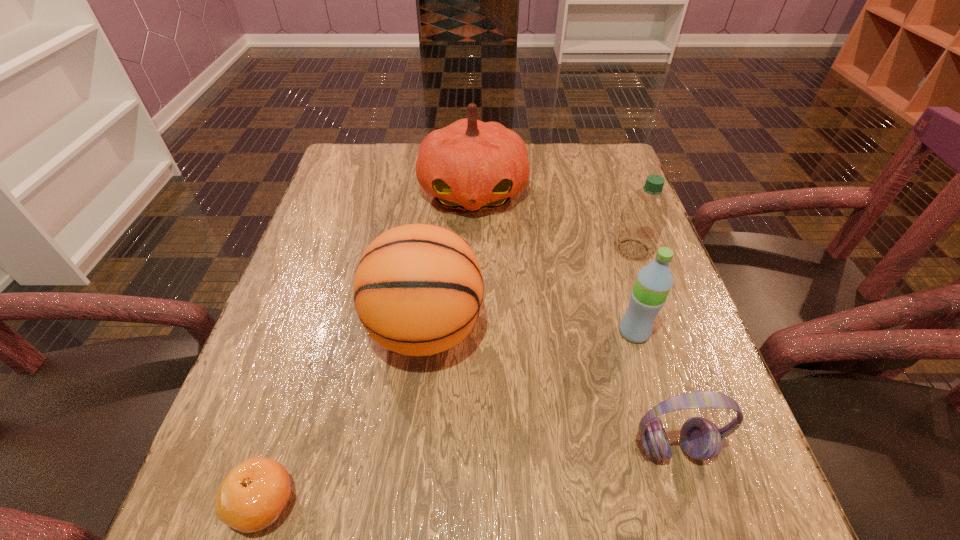
Locate an element on the screen. The height and width of the screenshot is (540, 960). free space located on the left of the nearer water bottle is located at coordinates (572, 332).

Where is `vacant region located 0.310m on the left of the farther water bottle`? The image size is (960, 540). vacant region located 0.310m on the left of the farther water bottle is located at coordinates (479, 249).

You are a GUI agent. You are given a task and a screenshot of the screen. Output one action in this format:
    pyautogui.click(x=<x>, y=<y>)
    Task: Click on the vacant space located 0.080m on the headband and ear cups of the headset
    Image resolution: width=960 pixels, height=540 pixels.
    Given the screenshot: What is the action you would take?
    pyautogui.click(x=697, y=525)

Find the location of a particular element. The image size is (960, 540). free location located 0.160m on the back of the leftmost object is located at coordinates (302, 379).

Where is `object at the far edge`? The image size is (960, 540). object at the far edge is located at coordinates (471, 165).

Find the location of `object present at the near edge`. object present at the near edge is located at coordinates (253, 495).

Find the location of `object that is at the left edge`. object that is at the left edge is located at coordinates (253, 495).

Identify the location of headset that is at the right edge. (700, 438).

Locate an element on the screen. object present at the near left corner is located at coordinates (253, 495).

This screenshot has width=960, height=540. Identify the location of vacant space at the far edge of the desktop. (542, 153).